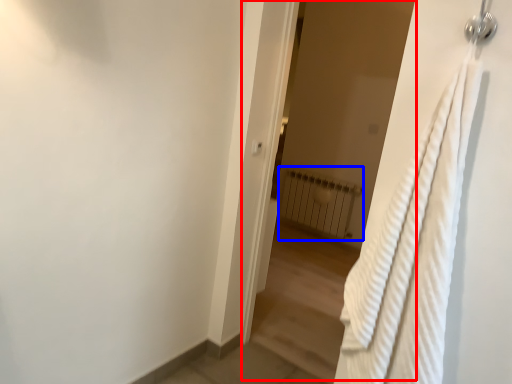
Question: Among these objects, which one is farthest to the camera, screen door (highlighted by a red box) or radiator (highlighted by a blue box)?

Choices:
 (A) screen door
 (B) radiator

Answer: (B)